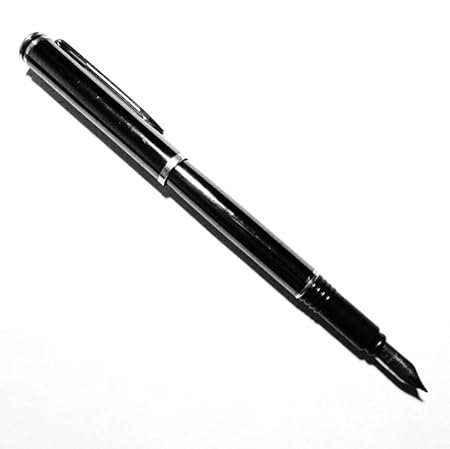
The image size is (450, 449). Identify the location of finial. (28, 37).